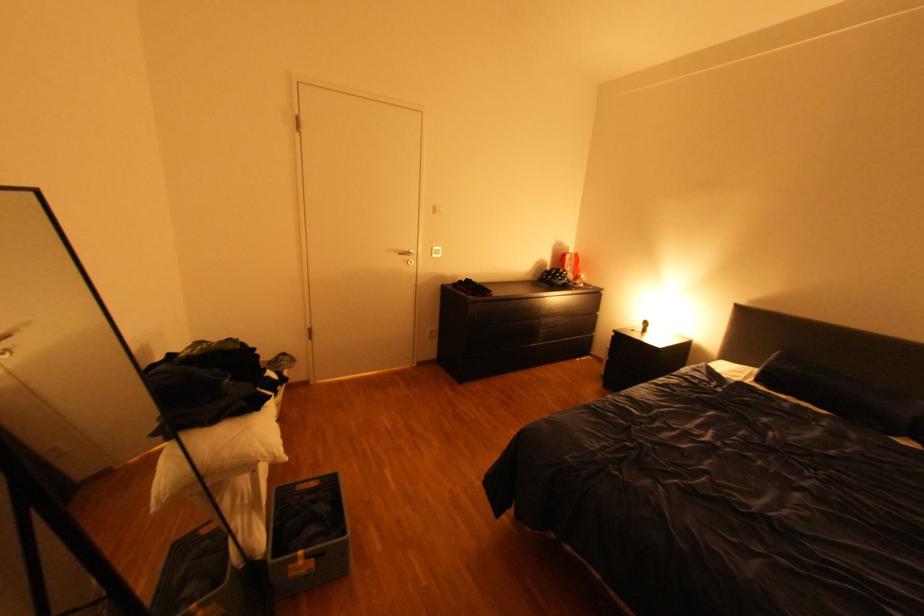
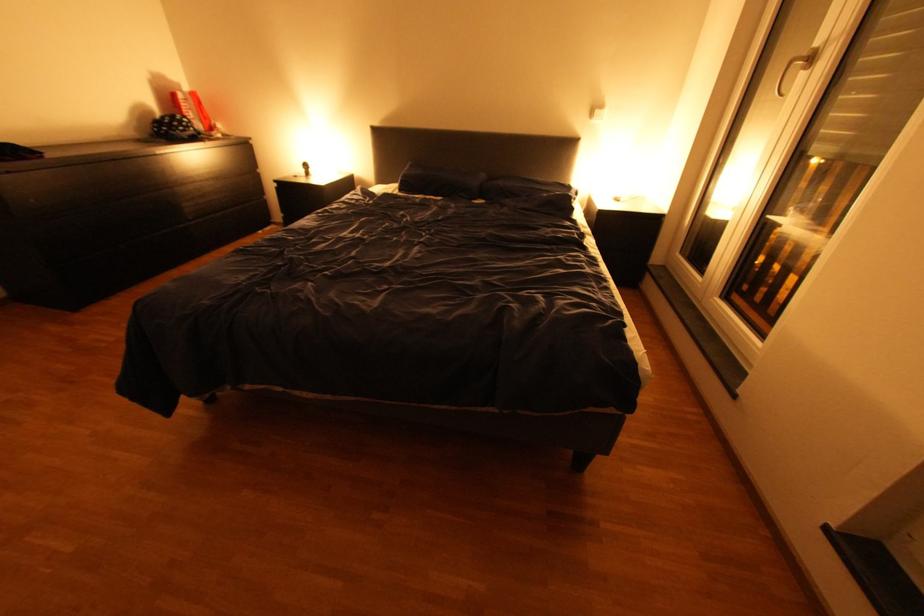
From the picture: Based on the continuous images, in which direction is the camera rotating?

The rotation direction of the camera is right-down.